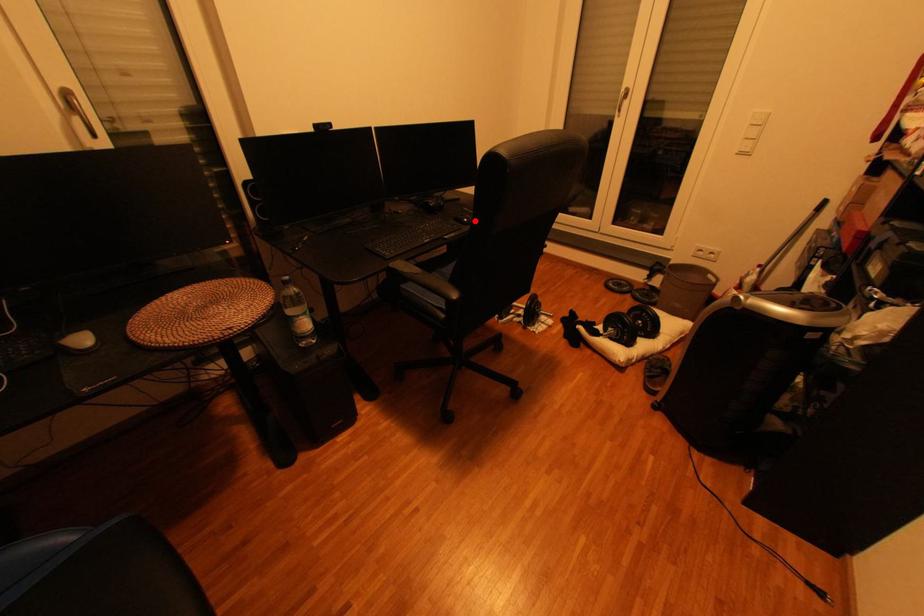
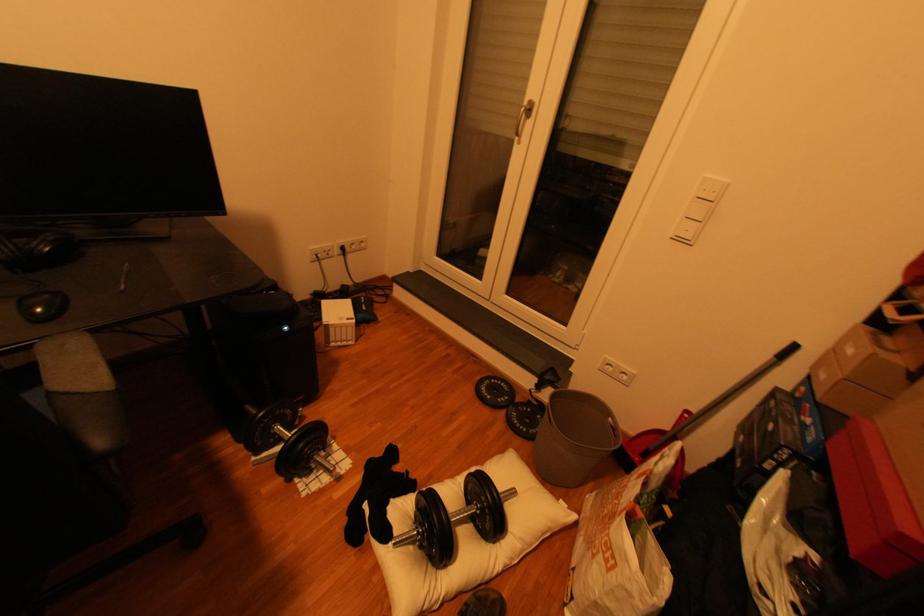
Find the pixel in the second image that matches the highlighted location in the first image.

(47, 310)